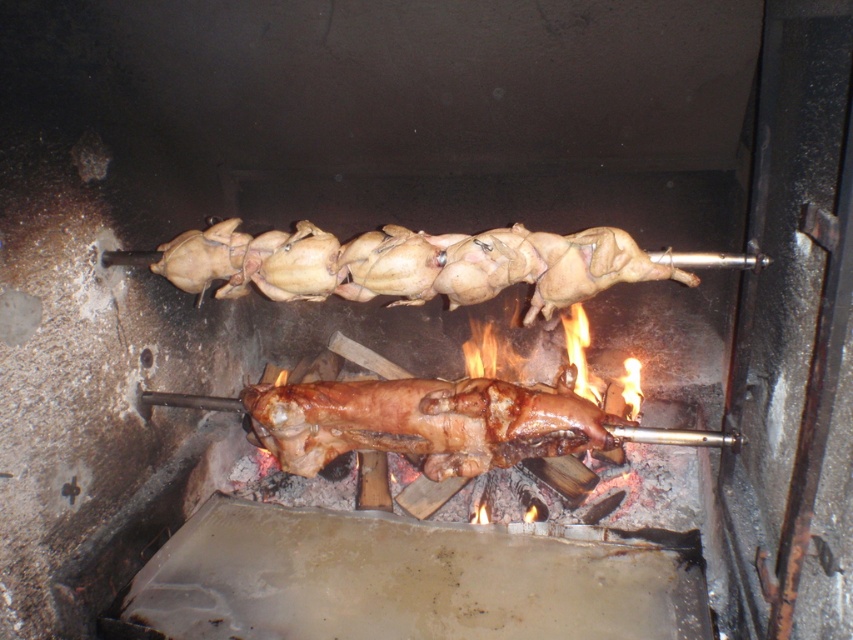
You are a chef preparing a feast and need to check the cooking progress of the golden brown chicken at center and the brown crispy pig at center. Which one is positioned higher above the heat source?

The golden brown chicken at center is positioned higher above the heat source than the brown crispy pig at center.